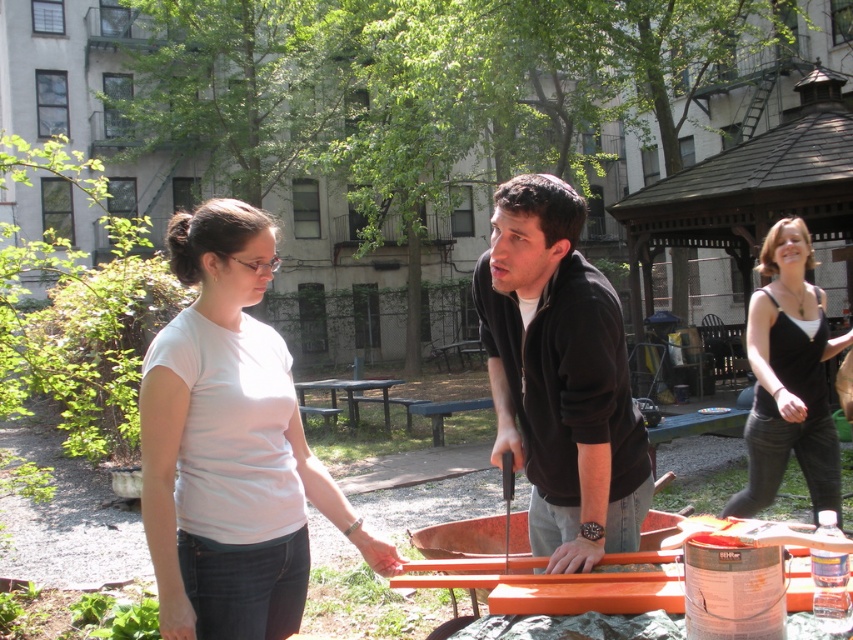
Does black matte jacket at center have a lesser width compared to black tank top at right?

Correct, black matte jacket at center's width is less than black tank top at right's.

Who is taller, black matte jacket at center or black tank top at right?

black tank top at right

What do you see at coordinates (560, 376) in the screenshot?
I see `black matte jacket at center` at bounding box center [560, 376].

The width and height of the screenshot is (853, 640). I want to click on black matte jacket at center, so click(560, 376).

Who is lower down, white matte t-shirt at center or black matte jacket at center?

white matte t-shirt at center is lower down.

Is white matte t-shirt at center in front of black matte jacket at center?

Yes, white matte t-shirt at center is closer to the viewer.

Find the location of a particular element. The image size is (853, 640). white matte t-shirt at center is located at coordinates (230, 445).

Is white matte t-shirt at center to the left of black tank top at right from the viewer's perspective?

Yes, white matte t-shirt at center is to the left of black tank top at right.

Find the location of a particular element. The width and height of the screenshot is (853, 640). white matte t-shirt at center is located at coordinates (230, 445).